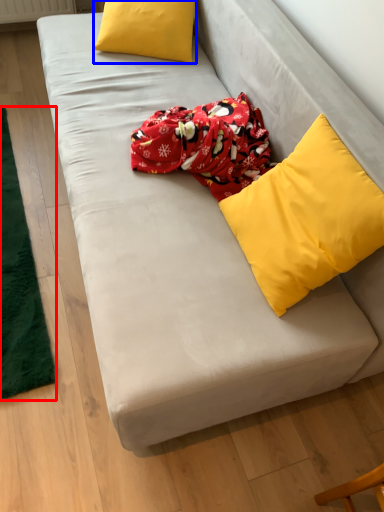
Question: Which point is further to the camera, mat (highlighted by a red box) or pillow (highlighted by a blue box)?

Choices:
 (A) mat
 (B) pillow

Answer: (B)